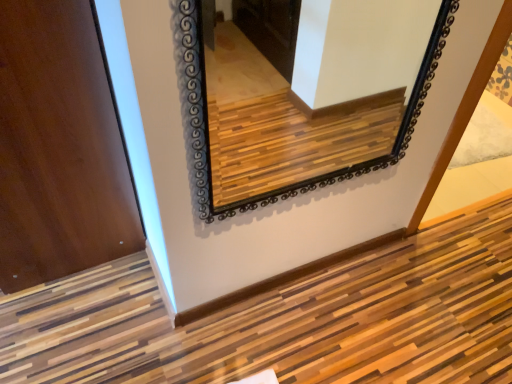
Question: Could you tell me if black glass mirror at upper center is turned towards matte wood door at left?

Choices:
 (A) yes
 (B) no

Answer: (B)

Question: From a real-world perspective, does black glass mirror at upper center stand above matte wood door at left?

Choices:
 (A) yes
 (B) no

Answer: (A)

Question: Is black glass mirror at upper center surrounding matte wood door at left?

Choices:
 (A) yes
 (B) no

Answer: (B)

Question: Does black glass mirror at upper center come in front of matte wood door at left?

Choices:
 (A) no
 (B) yes

Answer: (B)

Question: Would you say black glass mirror at upper center is outside matte wood door at left?

Choices:
 (A) no
 (B) yes

Answer: (B)

Question: Would you consider black glass mirror at upper center to be distant from matte wood door at left?

Choices:
 (A) no
 (B) yes

Answer: (B)

Question: Is matte wood door at left shorter than black glass mirror at upper center?

Choices:
 (A) no
 (B) yes

Answer: (A)

Question: Is matte wood door at left turned away from black glass mirror at upper center?

Choices:
 (A) no
 (B) yes

Answer: (A)

Question: Does matte wood door at left touch black glass mirror at upper center?

Choices:
 (A) no
 (B) yes

Answer: (A)

Question: Considering the relative positions of matte wood door at left and black glass mirror at upper center in the image provided, is matte wood door at left to the left of black glass mirror at upper center from the viewer's perspective?

Choices:
 (A) yes
 (B) no

Answer: (A)

Question: Considering the relative sizes of matte wood door at left and black glass mirror at upper center in the image provided, is matte wood door at left smaller than black glass mirror at upper center?

Choices:
 (A) yes
 (B) no

Answer: (B)

Question: Can black glass mirror at upper center be found inside matte wood door at left?

Choices:
 (A) no
 (B) yes

Answer: (A)

Question: In terms of size, does matte wood door at left appear bigger or smaller than black glass mirror at upper center?

Choices:
 (A) small
 (B) big

Answer: (B)